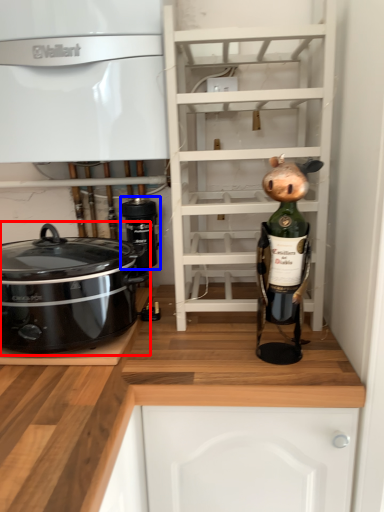
Question: Which point is closer to the camera, home appliance (highlighted by a red box) or appliance (highlighted by a blue box)?

Choices:
 (A) home appliance
 (B) appliance

Answer: (A)